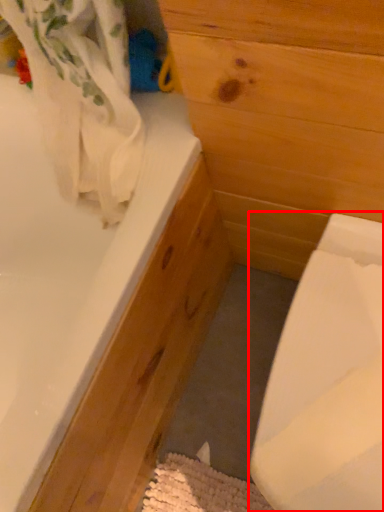
Question: Considering the relative positions of sink (annotated by the red box) and bathtub in the image provided, where is sink (annotated by the red box) located with respect to the staircase?

Choices:
 (A) right
 (B) left

Answer: (A)